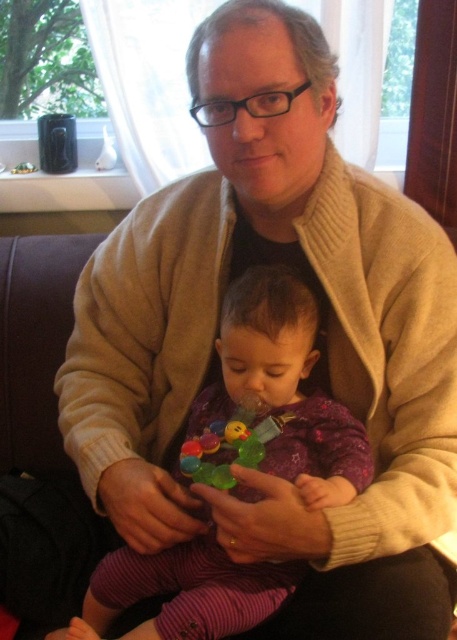
You are standing in the room and want to reach both points. Which point, point (105, 572) or point (286, 420), will you reach first?

You will reach point (105, 572) first because it is closer to you than point (286, 420), which is further away.

You are a photographer positioned 1 meter away from the translucent plastic toy at center. You want to take a closeup photo of the toy without moving the camera. Can you reach the toy with your camera lens? Explain.

The translucent plastic toy at center is 83.63 centimeters away from the camera. Since the photographer is positioned 1 meter away, which is approximately 100 centimeters, the distance between the camera and the toy is less than the photographer s position. Therefore, the photographer can adjust the lens to focus on the toy without needing to move closer.

You are a photographer standing in front of the scene. You want to take a photo of the purple fleece baby at center and the rubber teething ring at center. Which object will appear larger in your photo?

The purple fleece baby at center will appear larger in the photo because it is closer to the viewer than the rubber teething ring at center.